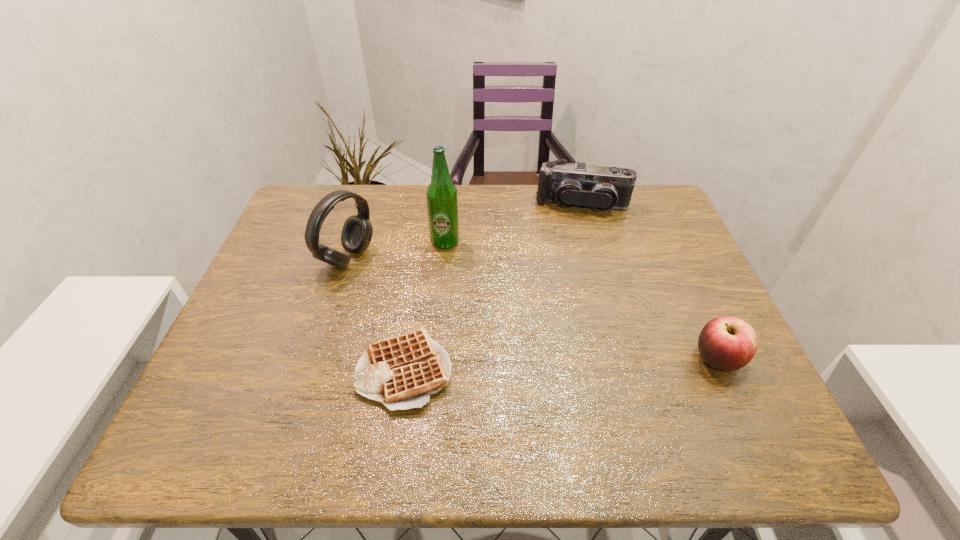
Where is `vacant spot on the desktop that is between the shortest object and the fourth tallest object and is positioned on the front-facing side of the camcorder`? vacant spot on the desktop that is between the shortest object and the fourth tallest object and is positioned on the front-facing side of the camcorder is located at coordinates (570, 364).

Identify the location of vacant space on the desktop that is between the shortest object and the rightmost object and is positioned on the label of the beer bottle. click(550, 364).

At what (x,y) coordinates should I click in order to perform the action: click on free spot on the desktop that is between the shortest object and the second shortest object and is positioned on the earcups of the leftmost object. Please return your answer as a coordinate pair (x, y). This screenshot has width=960, height=540. Looking at the image, I should click on (595, 363).